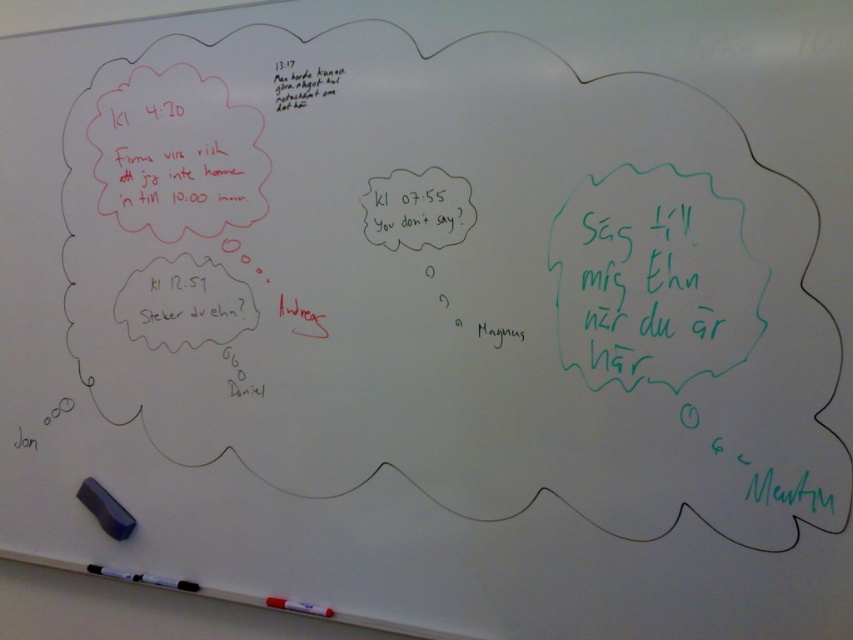
Can you confirm if white matte marker at lower left is taller than white matte marker at lower center?

Indeed, white matte marker at lower left has a greater height compared to white matte marker at lower center.

Measure the distance between white matte marker at lower left and white matte marker at lower center.

They are 9.82 inches apart.

Is point (184, 588) farther from camera compared to point (287, 608)?

Yes, point (184, 588) is behind point (287, 608).

Locate an element on the screen. The image size is (853, 640). white matte marker at lower left is located at coordinates (143, 579).